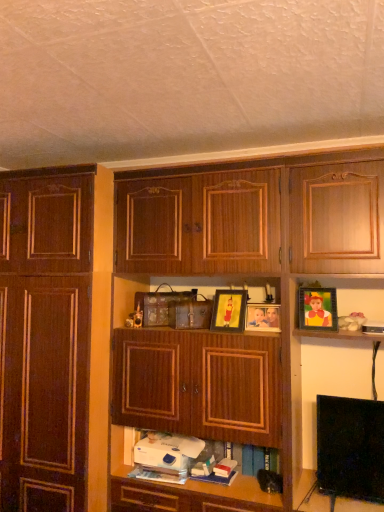
Question: Can you confirm if metallic gold picture frame at upper right, positioned as the 1th picture frame in right-to-left order, is wider than dark wood cabinet at left, the 1th cabinetry when ordered from left to right?

Choices:
 (A) no
 (B) yes

Answer: (A)

Question: Considering the relative sizes of metallic gold picture frame at upper right, positioned as the 1th picture frame in right-to-left order, and dark wood cabinet at left, the 1th cabinetry when ordered from left to right, in the image provided, is metallic gold picture frame at upper right, positioned as the 1th picture frame in right-to-left order, bigger than dark wood cabinet at left, the 1th cabinetry when ordered from left to right,?

Choices:
 (A) no
 (B) yes

Answer: (A)

Question: Is metallic gold picture frame at upper right, positioned as the 1th picture frame in right-to-left order, taller than dark wood cabinet at left, the 1th cabinetry when ordered from left to right?

Choices:
 (A) yes
 (B) no

Answer: (B)

Question: Is metallic gold picture frame at upper right, which is the 3th picture frame from left to right, not within dark wood cabinet at left, the 1th cabinetry when ordered from left to right?

Choices:
 (A) no
 (B) yes

Answer: (B)

Question: Can dark wood cabinet at left, the 1th cabinetry when ordered from left to right, be found inside metallic gold picture frame at upper right, positioned as the 1th picture frame in right-to-left order?

Choices:
 (A) yes
 (B) no

Answer: (B)

Question: From a real-world perspective, is metallic gold picture frame at upper right, which is the 3th picture frame from left to right, physically located above or below white matte book at center, positioned as the 1th book in right-to-left order?

Choices:
 (A) above
 (B) below

Answer: (A)

Question: Which is correct: metallic gold picture frame at upper right, positioned as the 1th picture frame in right-to-left order, is inside white matte book at center, positioned as the 1th book in right-to-left order, or outside of it?

Choices:
 (A) outside
 (B) inside

Answer: (A)

Question: From the image's perspective, is metallic gold picture frame at upper right, positioned as the 1th picture frame in right-to-left order, above or below white matte book at center, the second book in the left-to-right sequence?

Choices:
 (A) above
 (B) below

Answer: (A)

Question: Is point (314, 291) closer or farther from the camera than point (221, 475)?

Choices:
 (A) closer
 (B) farther

Answer: (A)

Question: In terms of height, does wooden cabinet at center, the 1th cabinetry from the right, look taller or shorter compared to white matte book at lower center, the 1th book from the left?

Choices:
 (A) tall
 (B) short

Answer: (A)

Question: Does point (210, 352) appear closer or farther from the camera than point (274, 484)?

Choices:
 (A) farther
 (B) closer

Answer: (B)

Question: In terms of size, does wooden cabinet at center, arranged as the second cabinetry when viewed from the left, appear bigger or smaller than white matte book at lower center, the second book viewed from the right?

Choices:
 (A) small
 (B) big

Answer: (B)

Question: Do you think wooden cabinet at center, arranged as the second cabinetry when viewed from the left, is within white matte book at lower center, the second book viewed from the right, or outside of it?

Choices:
 (A) inside
 (B) outside

Answer: (B)

Question: Considering the positions of point (67, 470) and point (72, 279), is point (67, 470) closer or farther from the camera than point (72, 279)?

Choices:
 (A) closer
 (B) farther

Answer: (A)

Question: Is wooden cabinet at center, arranged as the second cabinetry when viewed from the left, to the left or to the right of dark wood cabinet at left, acting as the 2th cabinetry starting from the right, in the image?

Choices:
 (A) left
 (B) right

Answer: (B)